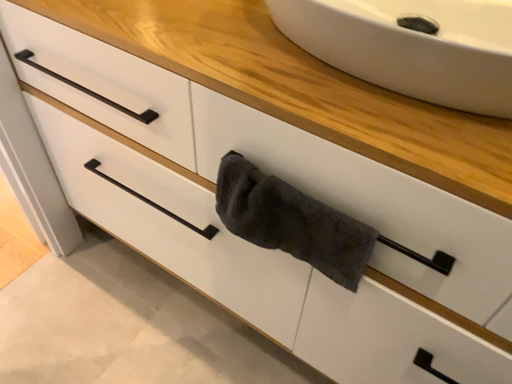
Find the location of `dark gray terry cloth towel at center`. dark gray terry cloth towel at center is located at coordinates (291, 221).

What do you see at coordinates (291, 221) in the screenshot?
I see `dark gray terry cloth towel at center` at bounding box center [291, 221].

Image resolution: width=512 pixels, height=384 pixels. What do you see at coordinates (412, 47) in the screenshot? I see `white ceramic sink at upper center` at bounding box center [412, 47].

Identify the location of white ceramic sink at upper center. point(412,47).

Locate an element on the screen. Image resolution: width=512 pixels, height=384 pixels. dark gray terry cloth towel at center is located at coordinates [x=291, y=221].

Does white ceramic sink at upper center appear on the left side of dark gray terry cloth towel at center?

Incorrect, white ceramic sink at upper center is not on the left side of dark gray terry cloth towel at center.

Which object is further away from the camera taking this photo, white ceramic sink at upper center or dark gray terry cloth towel at center?

Positioned behind is dark gray terry cloth towel at center.

Is point (348, 71) behind point (308, 209)?

Yes, point (348, 71) is behind point (308, 209).

From the image's perspective, is white ceramic sink at upper center above or below dark gray terry cloth towel at center?

white ceramic sink at upper center is above dark gray terry cloth towel at center.

From a real-world perspective, which object stands above the other?

In real-world perspective, white ceramic sink at upper center is above.

Considering the relative sizes of white ceramic sink at upper center and dark gray terry cloth towel at center in the image provided, is white ceramic sink at upper center wider than dark gray terry cloth towel at center?

Correct, the width of white ceramic sink at upper center exceeds that of dark gray terry cloth towel at center.

In the scene shown: Does white ceramic sink at upper center have a lesser height compared to dark gray terry cloth towel at center?

Yes.

Is white ceramic sink at upper center bigger or smaller than dark gray terry cloth towel at center?

Considering their sizes, white ceramic sink at upper center takes up more space than dark gray terry cloth towel at center.

Is white ceramic sink at upper center inside the boundaries of dark gray terry cloth towel at center, or outside?

white ceramic sink at upper center is not inside dark gray terry cloth towel at center, it's outside.

Is there a large distance between white ceramic sink at upper center and dark gray terry cloth towel at center?

white ceramic sink at upper center is near dark gray terry cloth towel at center, not far away.

Could you tell me if white ceramic sink at upper center is turned towards dark gray terry cloth towel at center?

No, white ceramic sink at upper center is not oriented towards dark gray terry cloth towel at center.

How many degrees apart are the facing directions of white ceramic sink at upper center and dark gray terry cloth towel at center?

1.04 degrees separate the facing orientations of white ceramic sink at upper center and dark gray terry cloth towel at center.

Identify the location of bath towel below the white ceramic sink at upper center (from a real-world perspective). (291, 221).

Is dark gray terry cloth towel at center to the left of white ceramic sink at upper center from the viewer's perspective?

Correct, you'll find dark gray terry cloth towel at center to the left of white ceramic sink at upper center.

Is dark gray terry cloth towel at center in front of or behind white ceramic sink at upper center in the image?

Visually, dark gray terry cloth towel at center is located behind white ceramic sink at upper center.

Which is behind, point (233, 188) or point (295, 0)?

The point (233, 188) is behind.

From the image's perspective, which one is positioned higher, dark gray terry cloth towel at center or white ceramic sink at upper center?

white ceramic sink at upper center is shown above in the image.

From a real-world perspective, is dark gray terry cloth towel at center below white ceramic sink at upper center?

Yes.

Considering the sizes of objects dark gray terry cloth towel at center and white ceramic sink at upper center in the image provided, who is thinner, dark gray terry cloth towel at center or white ceramic sink at upper center?

dark gray terry cloth towel at center is thinner.

Is dark gray terry cloth towel at center shorter than white ceramic sink at upper center?

No, dark gray terry cloth towel at center is not shorter than white ceramic sink at upper center.

Is dark gray terry cloth towel at center bigger than white ceramic sink at upper center?

No.

Is dark gray terry cloth towel at center inside or outside of white ceramic sink at upper center?

dark gray terry cloth towel at center cannot be found inside white ceramic sink at upper center.

Is dark gray terry cloth towel at center far away from white ceramic sink at upper center?

No, dark gray terry cloth towel at center is not far from white ceramic sink at upper center.

Is white ceramic sink at upper center at the back of dark gray terry cloth towel at center?

No, dark gray terry cloth towel at center's orientation is not away from white ceramic sink at upper center.

Can you tell me how much dark gray terry cloth towel at center and white ceramic sink at upper center differ in facing direction?

The facing directions of dark gray terry cloth towel at center and white ceramic sink at upper center are 1.04 degrees apart.

Image resolution: width=512 pixels, height=384 pixels. Identify the location of sink located in front of the dark gray terry cloth towel at center. (412, 47).

The height and width of the screenshot is (384, 512). What are the coordinates of `bath towel that is below the white ceramic sink at upper center (from the image's perspective)` in the screenshot? It's located at (291, 221).

Locate an element on the screen. sink that appears in front of the dark gray terry cloth towel at center is located at coordinates (412, 47).